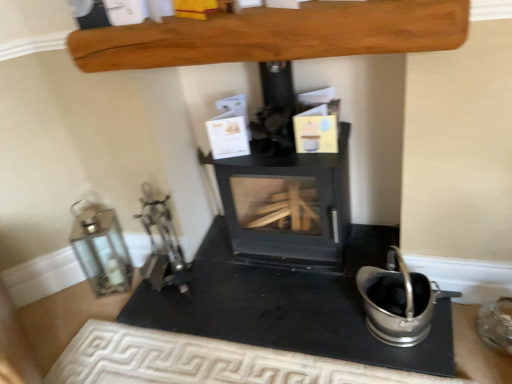
The height and width of the screenshot is (384, 512). Find the location of `vacant space situated on the left part of black matte wood burning stove at center`. vacant space situated on the left part of black matte wood burning stove at center is located at coordinates (219, 273).